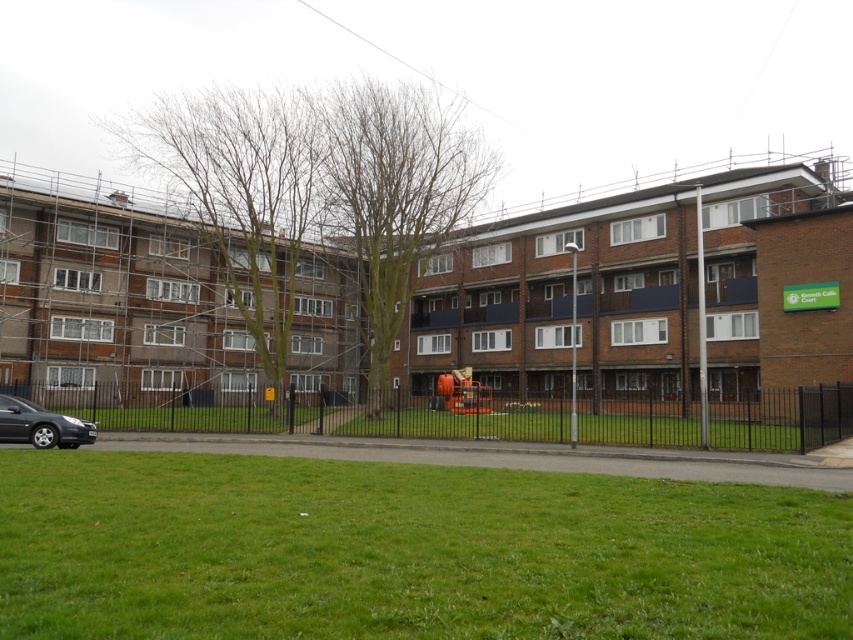
Question: Which of these objects is positioned closest to the green grass at center?

Choices:
 (A) green grass at lower center
 (B) matte black car at lower left

Answer: (B)

Question: Which point appears closest to the camera in this image?

Choices:
 (A) (442, 435)
 (B) (10, 403)

Answer: (B)

Question: Is the position of green grass at lower center less distant than that of matte black car at lower left?

Choices:
 (A) no
 (B) yes

Answer: (B)

Question: In this image, where is green grass at lower center located relative to matte black car at lower left?

Choices:
 (A) below
 (B) above

Answer: (B)

Question: Is green grass at center closer to the viewer compared to matte black car at lower left?

Choices:
 (A) yes
 (B) no

Answer: (B)

Question: Which point appears closest to the camera in this image?

Choices:
 (A) (274, 512)
 (B) (4, 397)

Answer: (A)